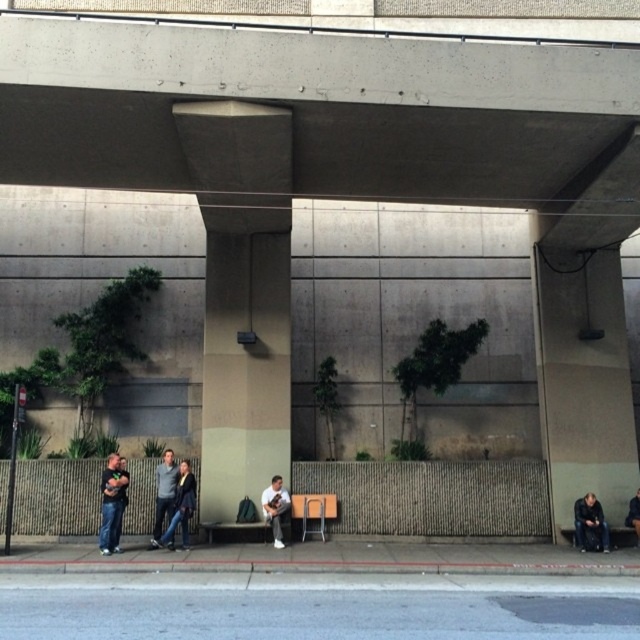
Between point (176, 516) and point (627, 522), which one is positioned behind?

Positioned behind is point (627, 522).

Is point (163, 476) positioned after point (627, 509)?

No.

Which is in front, point (179, 472) or point (628, 513)?

Positioned in front is point (179, 472).

Image resolution: width=640 pixels, height=640 pixels. Identify the location of dark gray sweater at center. (176, 500).

Who is lower down, brown concrete pillar at center or jeans at lower left?

Result: jeans at lower left

Is brown concrete pillar at center below jeans at lower left?

Incorrect, brown concrete pillar at center is not positioned below jeans at lower left.

Between point (248, 376) and point (116, 540), which one is positioned behind?

Point (248, 376)

This screenshot has width=640, height=640. What are the coordinates of `brown concrete pillar at center` in the screenshot? It's located at (244, 364).

From the picture: Can you confirm if concrete at upper center is thinner than light gray fabric jacket at center?

In fact, concrete at upper center might be wider than light gray fabric jacket at center.

From the picture: Does concrete at upper center lie in front of light gray fabric jacket at center?

Yes, concrete at upper center is in front of light gray fabric jacket at center.

Find the location of a particular element. The width and height of the screenshot is (640, 640). concrete at upper center is located at coordinates pyautogui.click(x=324, y=116).